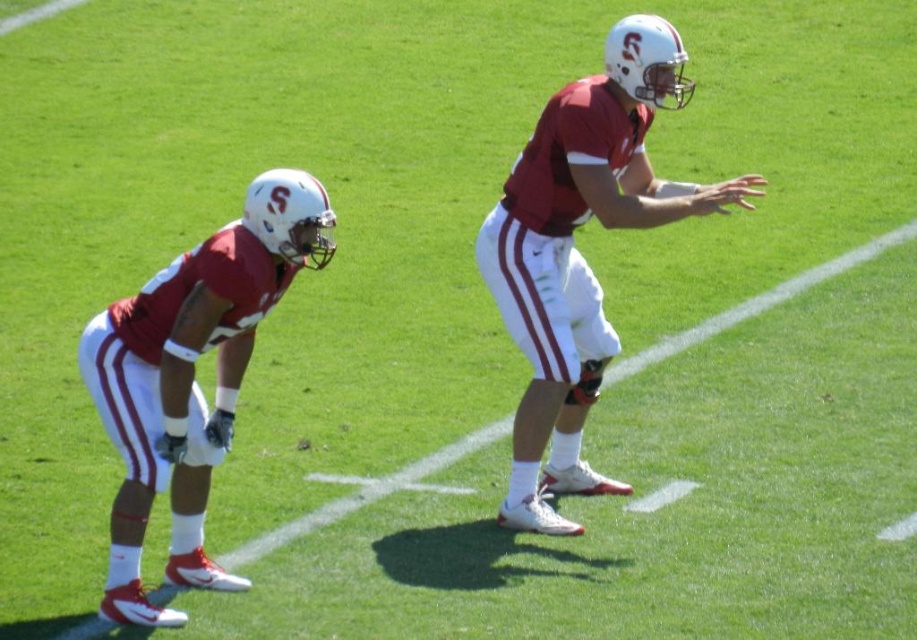
Question: Which object is farther from the camera taking this photo?

Choices:
 (A) matte red uniform at center
 (B) matte red uniform at left

Answer: (A)

Question: Considering the relative positions of matte red uniform at center and matte red uniform at left in the image provided, where is matte red uniform at center located with respect to matte red uniform at left?

Choices:
 (A) right
 (B) left

Answer: (A)

Question: Where is matte red uniform at center located in relation to matte red uniform at left in the image?

Choices:
 (A) left
 (B) right

Answer: (B)

Question: Is the position of matte red uniform at center more distant than that of matte red uniform at left?

Choices:
 (A) no
 (B) yes

Answer: (B)